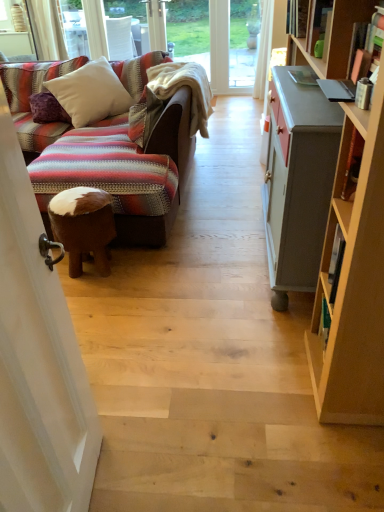
Question: From a real-world perspective, relative to purple velvet pillow at left, marked as the first pillow in a left-to-right arrangement, is white soft cushion at upper left, marked as the 2th pillow in a left-to-right arrangement, vertically above or below?

Choices:
 (A) below
 (B) above

Answer: (B)

Question: Looking at the image, does white soft cushion at upper left, marked as the 2th pillow in a left-to-right arrangement, seem bigger or smaller compared to purple velvet pillow at left, marked as the first pillow in a left-to-right arrangement?

Choices:
 (A) big
 (B) small

Answer: (A)

Question: Which is nearer to the brown fuzzy stool at lower left?

Choices:
 (A) hardcover book at upper right
 (B) purple velvet pillow at left, acting as the 2th pillow starting from the right
 (C) white soft cushion at upper left, which ranks as the 1th pillow in right-to-left order
 (D) transparent glass screen door at upper left

Answer: (D)

Question: Which is farther from the brown fuzzy stool at lower left?

Choices:
 (A) transparent glass screen door at upper left
 (B) hardcover book at upper right
 (C) white soft cushion at upper left, marked as the 2th pillow in a left-to-right arrangement
 (D) purple velvet pillow at left, acting as the 2th pillow starting from the right

Answer: (B)